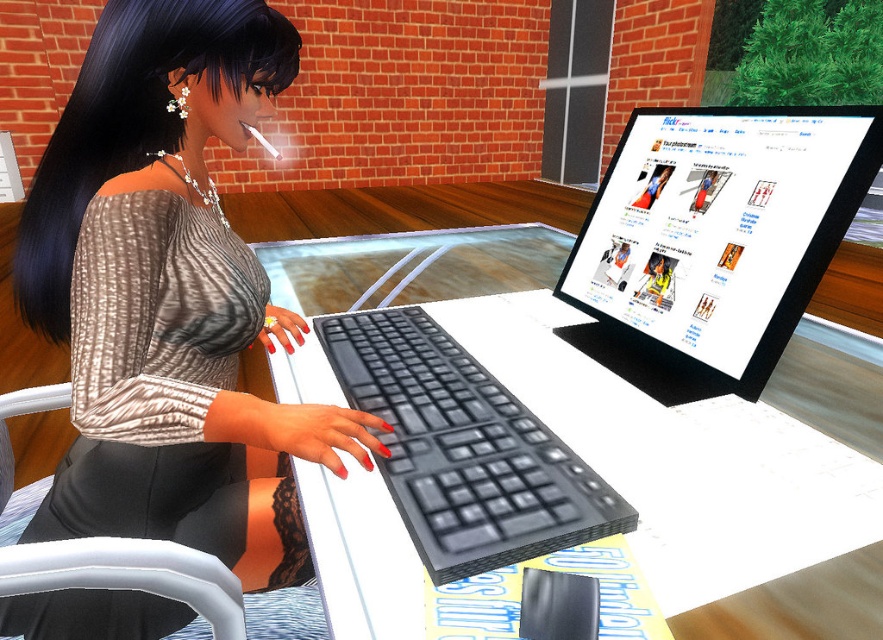
Question: Among these objects, which one is nearest to the camera?

Choices:
 (A) matte black monitor at upper right
 (B) black plastic keyboard at center
 (C) black matte keyboard at center
 (D) matte black dress at center

Answer: (B)

Question: Which object is the closest to the matte black monitor at upper right?

Choices:
 (A) black plastic keyboard at center
 (B) black matte keyboard at center

Answer: (A)

Question: Is matte black dress at center behind black plastic keyboard at center?

Choices:
 (A) no
 (B) yes

Answer: (B)

Question: Is matte black dress at center positioned in front of black plastic keyboard at center?

Choices:
 (A) no
 (B) yes

Answer: (A)

Question: Can you confirm if matte black dress at center is positioned below matte black monitor at upper right?

Choices:
 (A) yes
 (B) no

Answer: (A)

Question: Which object appears farthest from the camera in this image?

Choices:
 (A) matte black monitor at upper right
 (B) black matte keyboard at center

Answer: (A)